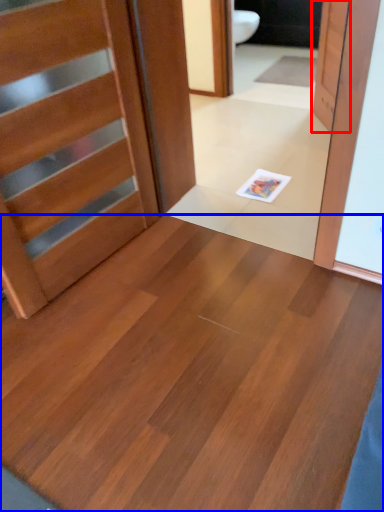
Question: Which object is further to the camera taking this photo, door (highlighted by a red box) or plywood (highlighted by a blue box)?

Choices:
 (A) door
 (B) plywood

Answer: (A)